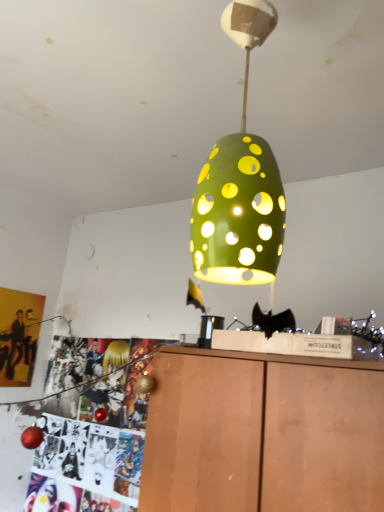
Question: Based on their sizes in the image, would you say green matte/porcelain lamp at center is bigger or smaller than wooden cabinet at lower center?

Choices:
 (A) big
 (B) small

Answer: (B)

Question: Is green matte/porcelain lamp at center inside the boundaries of wooden cabinet at lower center, or outside?

Choices:
 (A) outside
 (B) inside

Answer: (A)

Question: Estimate the real-world distances between objects in this image. Which object is farther from the matte yellow poster at left?

Choices:
 (A) green matte/porcelain lamp at center
 (B) wooden cabinet at lower center

Answer: (A)

Question: Estimate the real-world distances between objects in this image. Which object is closer to the wooden cabinet at lower center?

Choices:
 (A) green matte/porcelain lamp at center
 (B) matte yellow poster at left

Answer: (A)